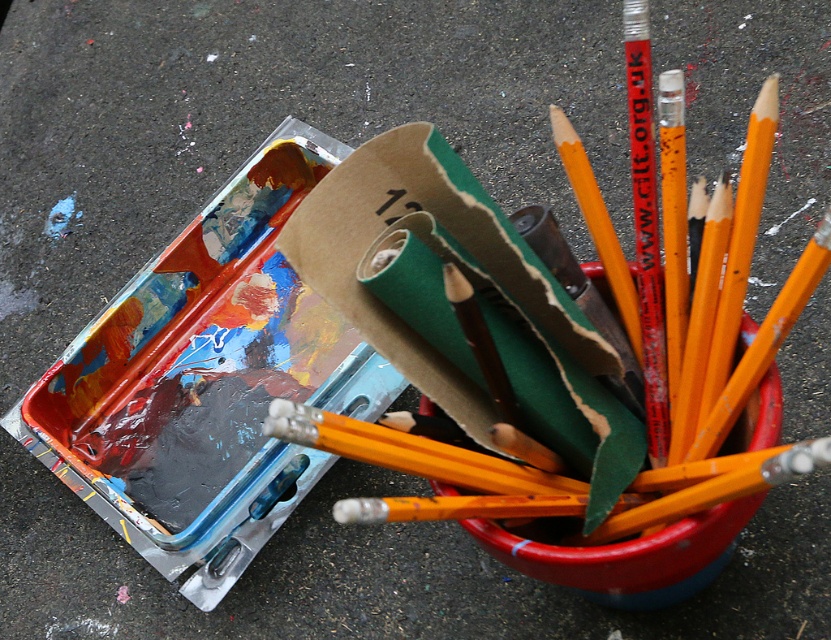
Question: Where is yellow wood paint brush at upper center located in relation to yellow wood pencil at upper right in the image?

Choices:
 (A) below
 (B) above

Answer: (A)

Question: Which point is farther to the camera?

Choices:
 (A) (556, 509)
 (B) (785, 305)

Answer: (A)

Question: Which object appears farthest from the camera in this image?

Choices:
 (A) white eraser at center
 (B) orange wood pencil at upper right
 (C) smooth orange pencil at upper right

Answer: (C)

Question: Is the position of orange wood pencil at upper right more distant than that of white eraser at center?

Choices:
 (A) no
 (B) yes

Answer: (B)

Question: Does smooth orange pencil at upper right appear under white eraser at center?

Choices:
 (A) no
 (B) yes

Answer: (A)

Question: Which point is closer to the camera?

Choices:
 (A) (743, 225)
 (B) (623, 522)

Answer: (B)